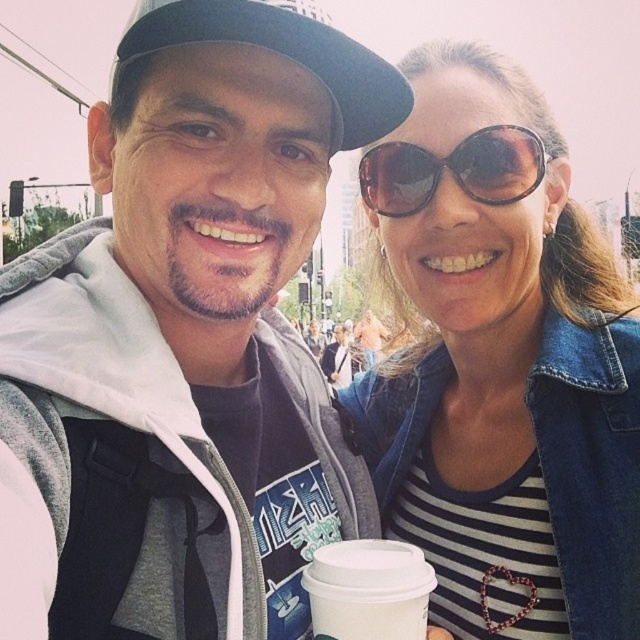
Question: Is matte gray hoodie at center closer to the viewer compared to black fabric baseball cap at upper left?

Choices:
 (A) yes
 (B) no

Answer: (A)

Question: Is striped fabric shirt at center wider than sunglasses at center?

Choices:
 (A) no
 (B) yes

Answer: (B)

Question: Which of the following is the farthest from the observer?

Choices:
 (A) white paper cup at center
 (B) sunglasses at center
 (C) matte gray hoodie at center
 (D) striped fabric shirt at center

Answer: (B)

Question: Observing the image, what is the correct spatial positioning of matte gray hoodie at center in reference to black fabric baseball cap at upper left?

Choices:
 (A) right
 (B) left

Answer: (B)

Question: Which is farther from the black fabric baseball cap at upper left?

Choices:
 (A) white paper cup at center
 (B) sunglasses at center

Answer: (A)

Question: Among these objects, which one is farthest from the camera?

Choices:
 (A) black fabric baseball cap at upper left
 (B) matte gray hoodie at center
 (C) striped fabric shirt at center

Answer: (C)